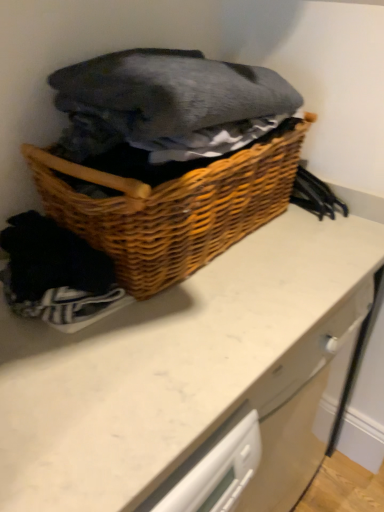
Question: Does woven wood basket at center lie in front of white marble counter at center?

Choices:
 (A) yes
 (B) no

Answer: (A)

Question: Is woven wood basket at center not near white marble counter at center?

Choices:
 (A) yes
 (B) no

Answer: (B)

Question: Does woven wood basket at center touch white marble counter at center?

Choices:
 (A) yes
 (B) no

Answer: (B)

Question: From the image's perspective, is woven wood basket at center over white marble counter at center?

Choices:
 (A) yes
 (B) no

Answer: (A)

Question: Is woven wood basket at center facing away from white marble counter at center?

Choices:
 (A) yes
 (B) no

Answer: (B)

Question: Which is correct: dark gray cotton blanket at upper center is inside woven wood basket at center, or outside of it?

Choices:
 (A) outside
 (B) inside

Answer: (A)

Question: Considering their positions, is dark gray cotton blanket at upper center located in front of or behind woven wood basket at center?

Choices:
 (A) behind
 (B) front

Answer: (B)

Question: Considering the positions of dark gray cotton blanket at upper center and woven wood basket at center in the image, is dark gray cotton blanket at upper center taller or shorter than woven wood basket at center?

Choices:
 (A) short
 (B) tall

Answer: (A)

Question: From a real-world perspective, relative to woven wood basket at center, is dark gray cotton blanket at upper center vertically above or below?

Choices:
 (A) below
 (B) above

Answer: (B)

Question: Considering their positions, is dark gray cotton blanket at upper center located in front of or behind white marble counter at center?

Choices:
 (A) front
 (B) behind

Answer: (A)

Question: From their relative heights in the image, would you say dark gray cotton blanket at upper center is taller or shorter than white marble counter at center?

Choices:
 (A) tall
 (B) short

Answer: (B)

Question: Do you think dark gray cotton blanket at upper center is within white marble counter at center, or outside of it?

Choices:
 (A) outside
 (B) inside

Answer: (A)

Question: Considering the positions of dark gray cotton blanket at upper center and white marble counter at center in the image, is dark gray cotton blanket at upper center wider or thinner than white marble counter at center?

Choices:
 (A) wide
 (B) thin

Answer: (B)

Question: Considering the positions of point (190, 179) and point (286, 84), is point (190, 179) closer or farther from the camera than point (286, 84)?

Choices:
 (A) farther
 (B) closer

Answer: (B)

Question: In the image, is woven wood basket at center positioned in front of or behind dark gray cotton blanket at upper center?

Choices:
 (A) behind
 (B) front

Answer: (A)